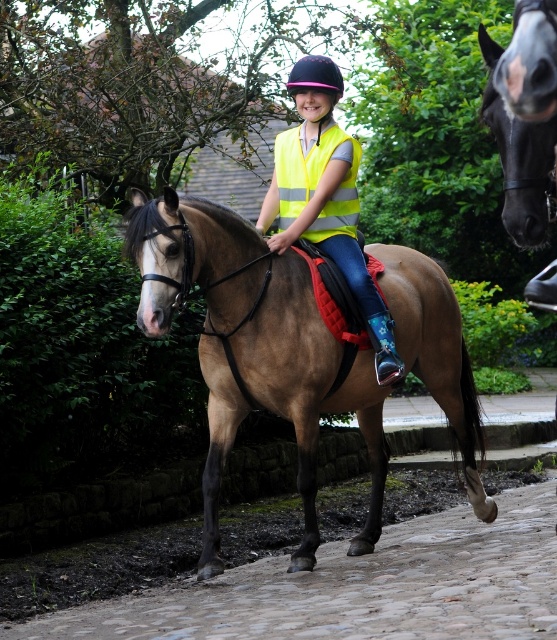
Is cobblestone path at lower center to the right of neon yellow reflective vest at center from the viewer's perspective?

Yes, cobblestone path at lower center is to the right of neon yellow reflective vest at center.

Does cobblestone path at lower center have a greater height compared to neon yellow reflective vest at center?

In fact, cobblestone path at lower center may be shorter than neon yellow reflective vest at center.

The image size is (557, 640). Find the location of `cobblestone path at lower center`. cobblestone path at lower center is located at coordinates (359, 586).

This screenshot has width=557, height=640. In order to click on cobblestone path at lower center in this screenshot , I will do `click(359, 586)`.

Looking at this image, is cobblestone path at lower center thinner than black glossy horse at upper center?

No, cobblestone path at lower center is not thinner than black glossy horse at upper center.

Who is positioned more to the left, cobblestone path at lower center or black glossy horse at upper center?

Positioned to the left is black glossy horse at upper center.

Who is more distant from viewer, (280, 589) or (532, 182)?

Point (280, 589)

You are a GUI agent. You are given a task and a screenshot of the screen. Output one action in this format:
    pyautogui.click(x=<x>, y=<y>)
    Task: Click on the cobblestone path at lower center
    This screenshot has height=640, width=557.
    Given the screenshot: What is the action you would take?
    pyautogui.click(x=359, y=586)

Based on the photo, between black glossy horse at upper center and bright yellow reflective vest at center, which one appears on the right side from the viewer's perspective?

black glossy horse at upper center

Between point (555, 193) and point (356, 164), which one is positioned behind?

The point (356, 164) is more distant.

Locate an element on the screen. Image resolution: width=557 pixels, height=640 pixels. black glossy horse at upper center is located at coordinates (520, 160).